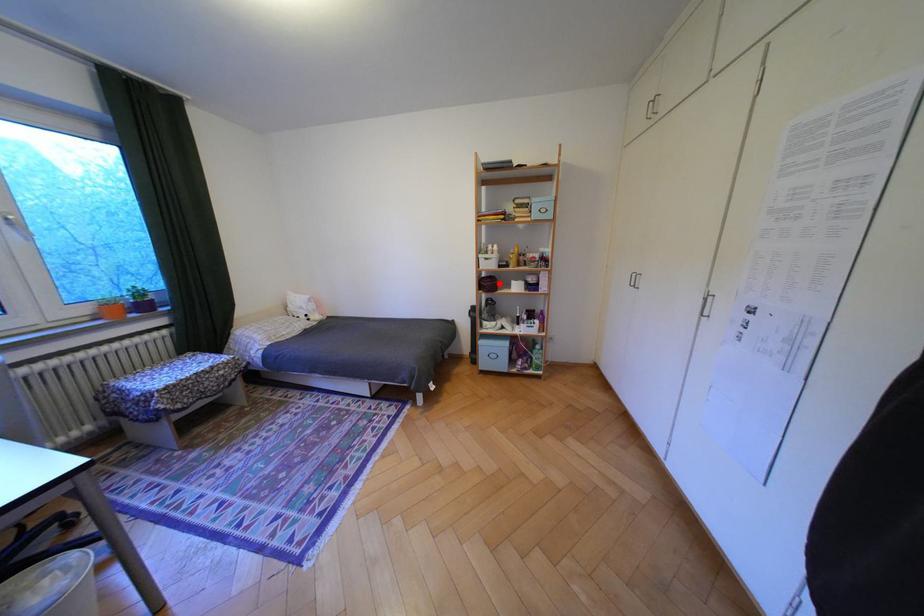
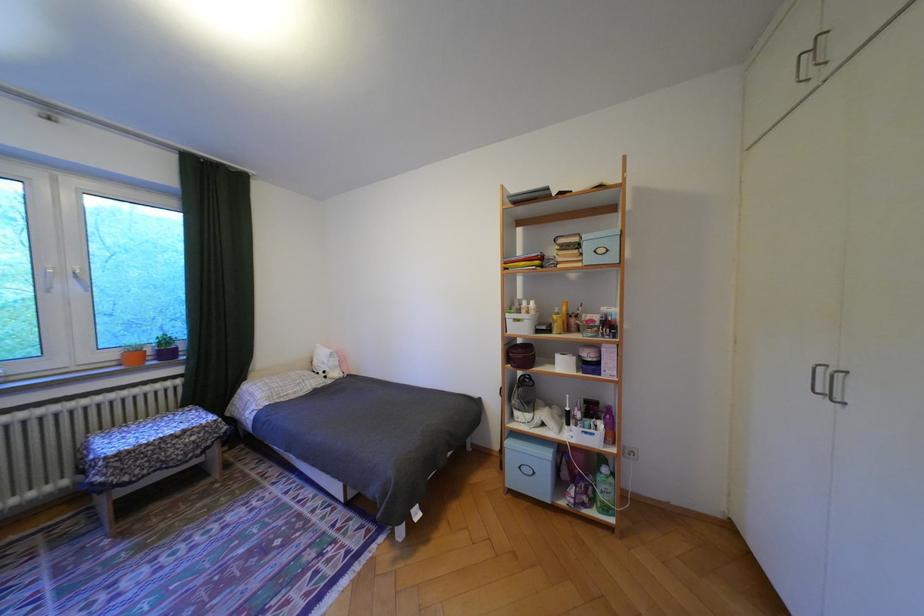
Question: I am providing you with two images of the same scene from different viewpoints. Image1 has a red point marked. In image2, the corresponding 3D location appears at what relative position? Reply with the corresponding letter.

Choices:
 (A) Closer
 (B) Farther

Answer: (B)